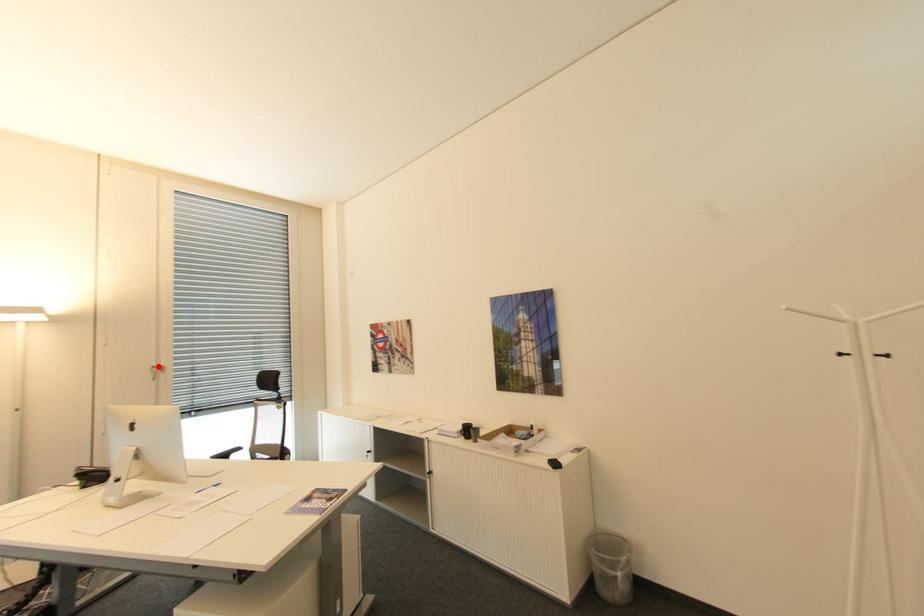
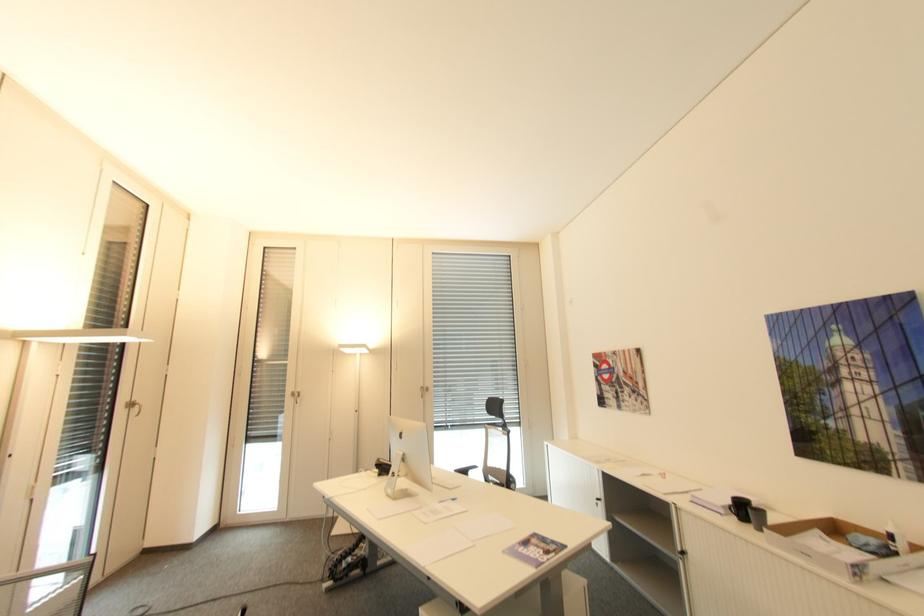
Question: I am providing you with two images of the same scene from different viewpoints. Given a red point in image1, look at the same physical point in image2. Is it:

Choices:
 (A) Closer to the viewpoint
 (B) Farther from the viewpoint

Answer: (B)